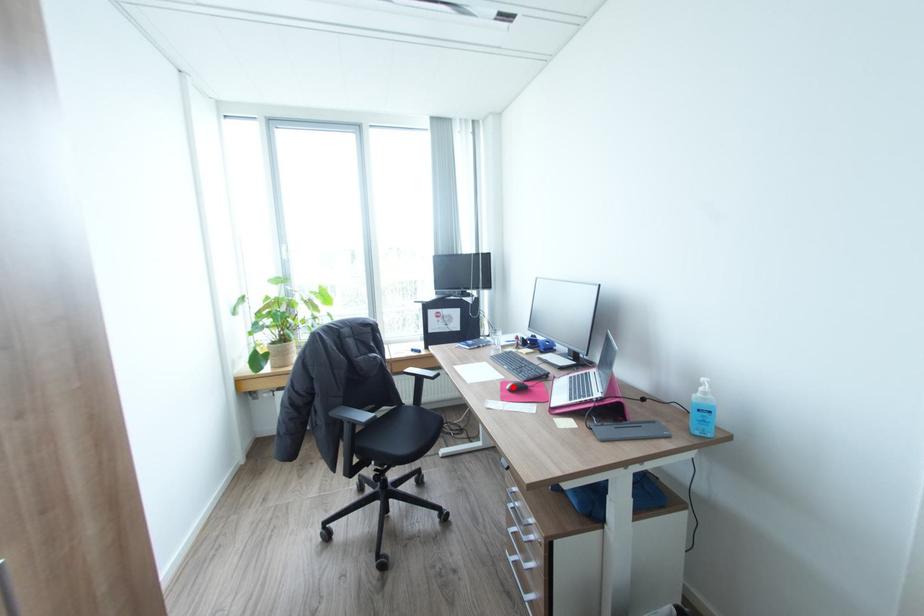
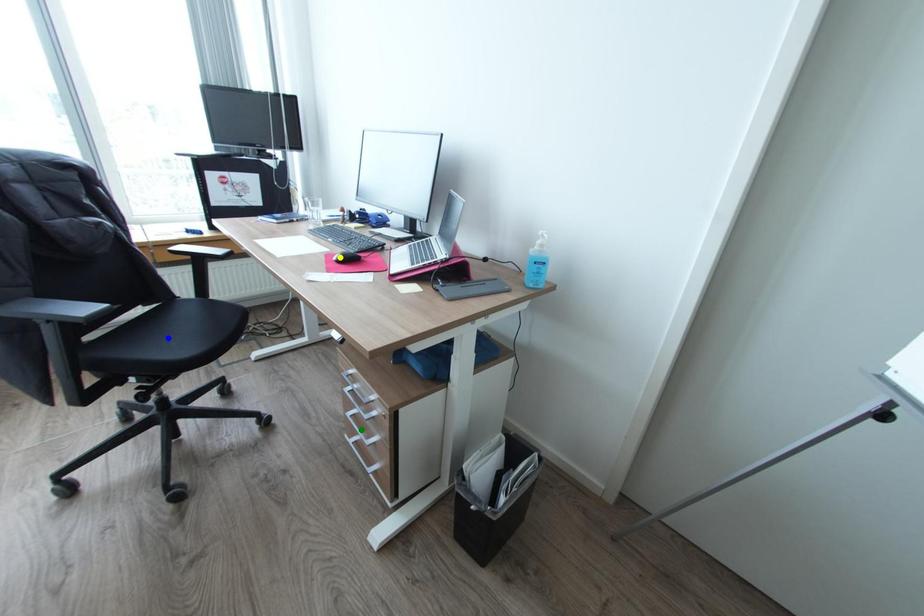
Question: I am providing you with two images of the same scene from different viewpoints. A red point is marked on the first image. You are given multiple points on the second image. Which spot in image 2 lines up with the point in image 1?

Choices:
 (A) green point
 (B) blue point
 (C) yellow point

Answer: (C)